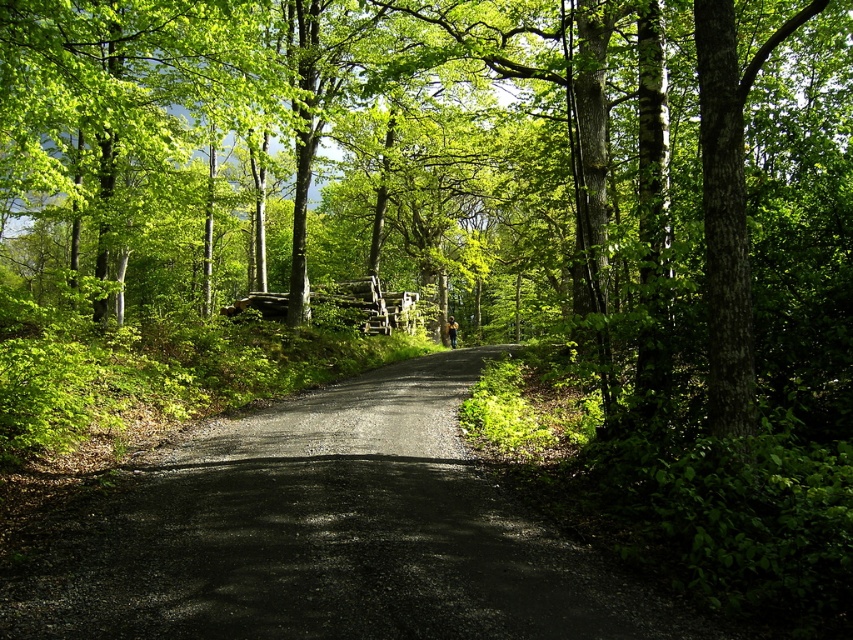
Question: Is green leafy tree at center bigger than dirt/gravel road at center?

Choices:
 (A) no
 (B) yes

Answer: (B)

Question: Is green leafy tree at center bigger than dirt/gravel road at center?

Choices:
 (A) no
 (B) yes

Answer: (B)

Question: Which object appears closest to the camera in this image?

Choices:
 (A) dirt/gravel road at center
 (B) green leafy tree at center

Answer: (A)

Question: Which point is farther to the camera?

Choices:
 (A) green leafy tree at center
 (B) dirt/gravel road at center

Answer: (A)

Question: Is green leafy tree at center behind dirt/gravel road at center?

Choices:
 (A) yes
 (B) no

Answer: (A)